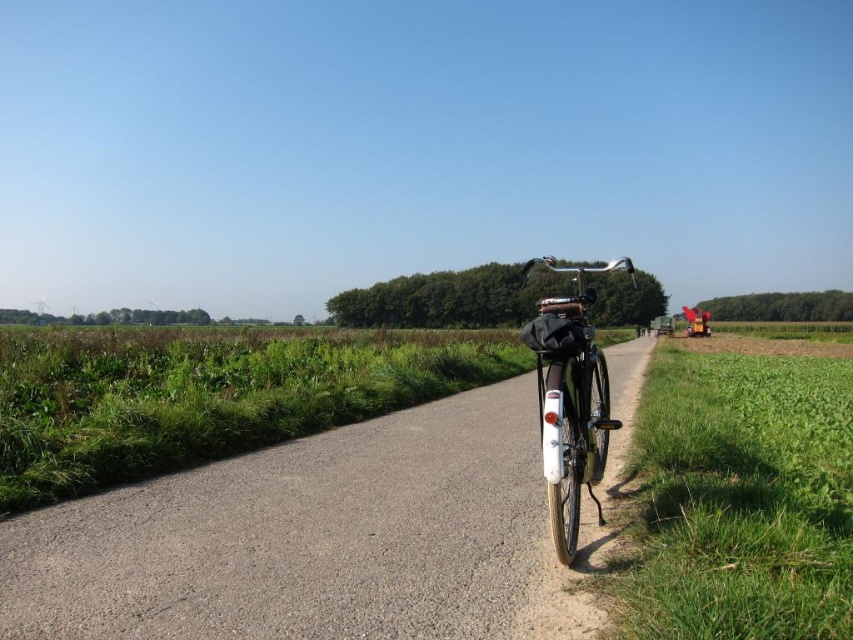
Question: Does asphalt road at center appear over shiny metallic bicycle at center?

Choices:
 (A) yes
 (B) no

Answer: (B)

Question: Which point is farther from the camera taking this photo?

Choices:
 (A) (599, 506)
 (B) (621, 362)

Answer: (B)

Question: Is asphalt road at center further to the viewer compared to shiny metallic bicycle at center?

Choices:
 (A) no
 (B) yes

Answer: (A)

Question: Can you confirm if asphalt road at center is wider than shiny metallic bicycle at center?

Choices:
 (A) yes
 (B) no

Answer: (B)

Question: Which object is farther from the camera taking this photo?

Choices:
 (A) asphalt road at center
 (B) shiny metallic bicycle at center

Answer: (B)